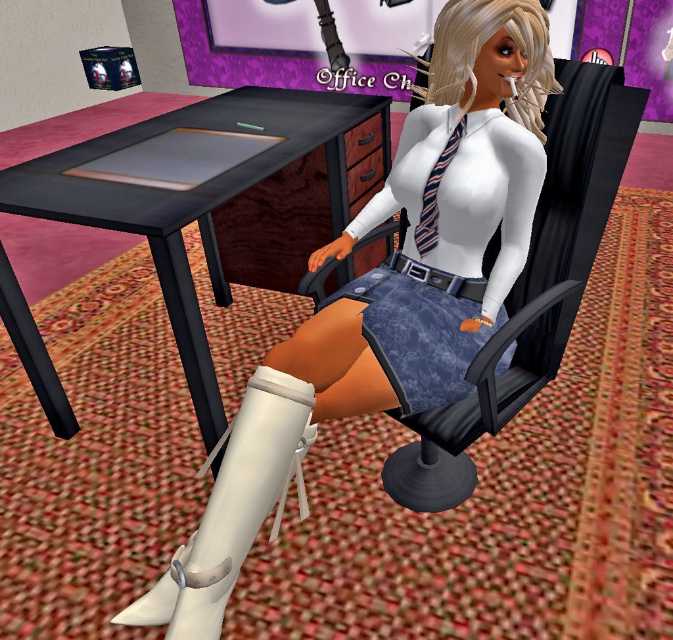
Question: Which of the following is the farthest from the observer?

Choices:
 (A) white matte boot at lower center
 (B) white matte thigh-high boots at lower center

Answer: (B)

Question: In this image, where is black wood table at center located relative to matte black swivel chair at center?

Choices:
 (A) below
 (B) above

Answer: (B)

Question: Is white matte thigh-high boots at lower center closer to camera compared to matte black swivel chair at center?

Choices:
 (A) yes
 (B) no

Answer: (A)

Question: From the image, what is the correct spatial relationship of black wood table at center in relation to matte black swivel chair at center?

Choices:
 (A) above
 (B) below

Answer: (A)

Question: Which of the following is the farthest from the observer?

Choices:
 (A) white matte thigh-high boots at lower center
 (B) white matte boot at lower center
 (C) matte black swivel chair at center

Answer: (C)

Question: Among these points, which one is farthest from the camera?

Choices:
 (A) (215, 611)
 (B) (509, 225)
 (C) (81, 205)

Answer: (C)